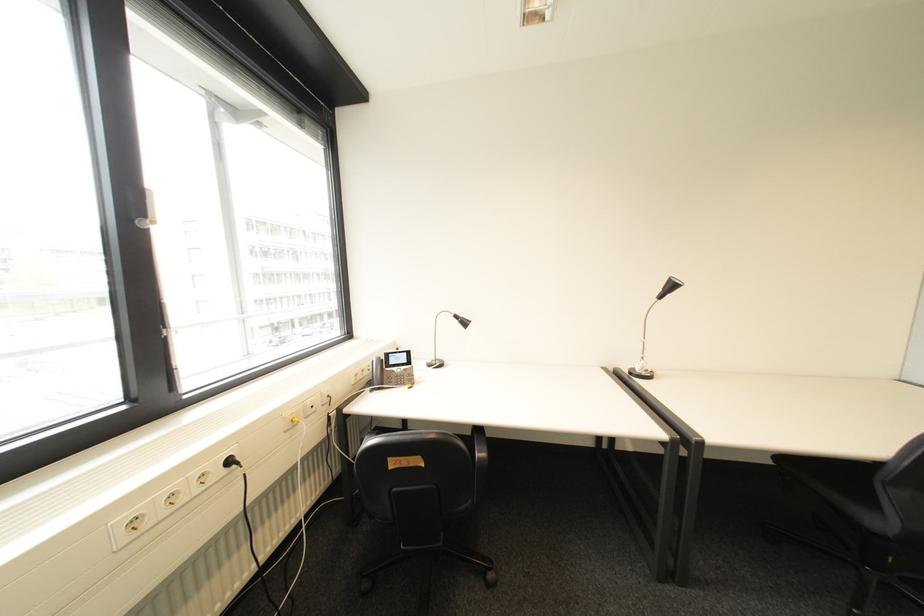
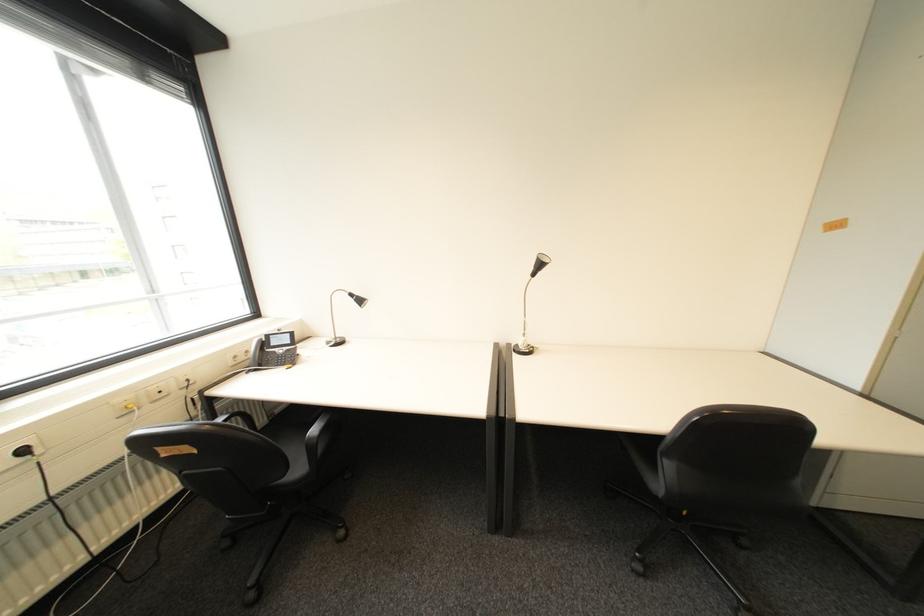
Where in the second image is the point corresponding to point (239, 463) from the first image?

(34, 452)